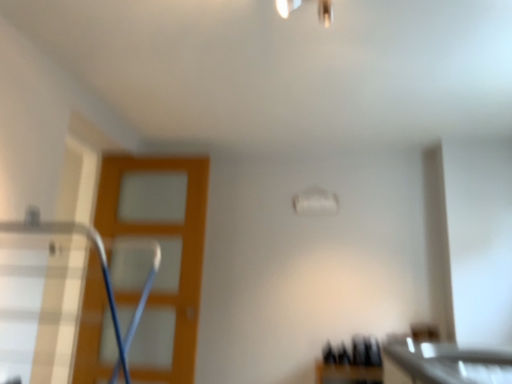
Question: Considering their positions, is metallic silver swivel chair at left located in front of or behind orange wood screen door at left?

Choices:
 (A) behind
 (B) front

Answer: (B)

Question: From the image's perspective, is metallic silver swivel chair at left positioned above or below orange wood screen door at left?

Choices:
 (A) above
 (B) below

Answer: (A)

Question: Considering the real-world distances, which object is closest to the orange wood screen door at left?

Choices:
 (A) metallic silver swivel chair at left
 (B) white glossy countertop at lower right

Answer: (A)

Question: Which object is positioned farthest from the orange wood screen door at left?

Choices:
 (A) metallic silver swivel chair at left
 (B) white glossy countertop at lower right

Answer: (B)